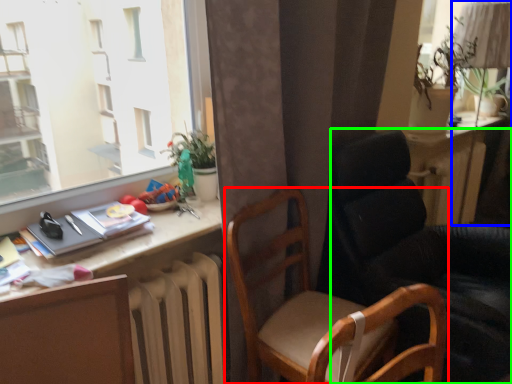
Question: Which object is positioned farthest from chair (highlighted by a red box)? Select from table lamp (highlighted by a blue box) and chair (highlighted by a green box).

Choices:
 (A) table lamp
 (B) chair

Answer: (A)